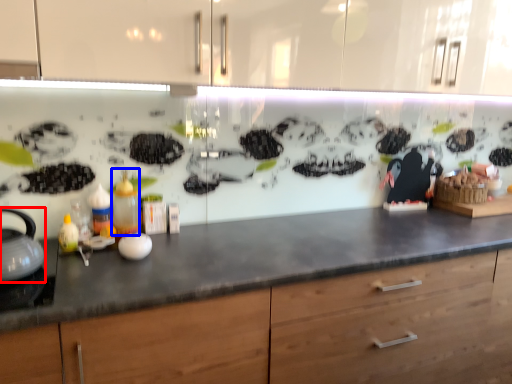
Question: Which object appears farthest to the camera in this image, tea pot (highlighted by a red box) or bottle (highlighted by a blue box)?

Choices:
 (A) tea pot
 (B) bottle

Answer: (B)